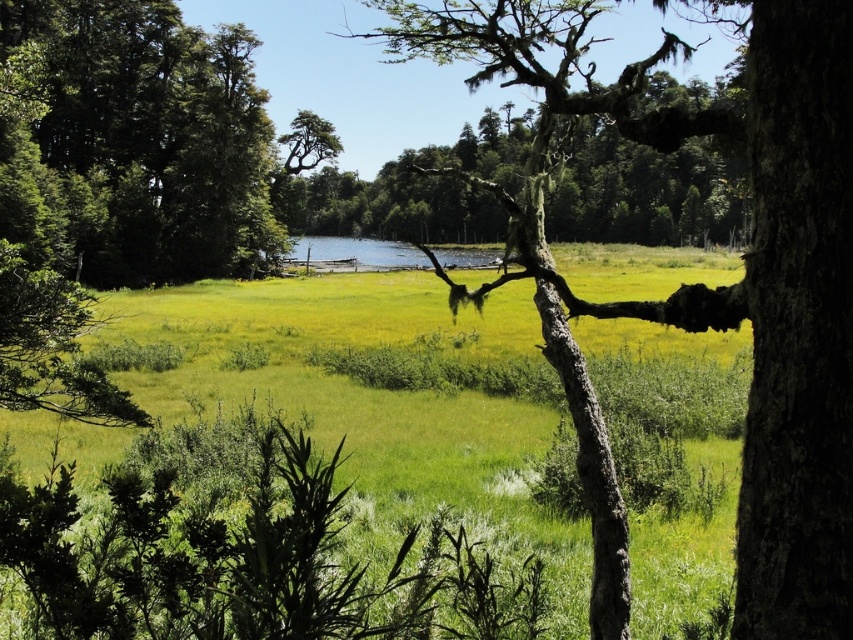
Question: Which point is farther to the camera?

Choices:
 (A) green leafy tree at left
 (B) smooth bark tree at center
 (C) clear blue water at center

Answer: (C)

Question: Which object is the closest to the clear blue water at center?

Choices:
 (A) green leafy tree at left
 (B) smooth bark tree at center

Answer: (B)

Question: Among these points, which one is nearest to the camera?

Choices:
 (A) (608, 449)
 (B) (231, 29)
 (C) (322, 237)

Answer: (A)

Question: Is green leafy tree at left positioned in front of clear blue water at center?

Choices:
 (A) yes
 (B) no

Answer: (A)

Question: Is green leafy tree at left to the right of smooth bark tree at center from the viewer's perspective?

Choices:
 (A) no
 (B) yes

Answer: (A)

Question: Does green leafy tree at left have a lesser width compared to clear blue water at center?

Choices:
 (A) yes
 (B) no

Answer: (A)